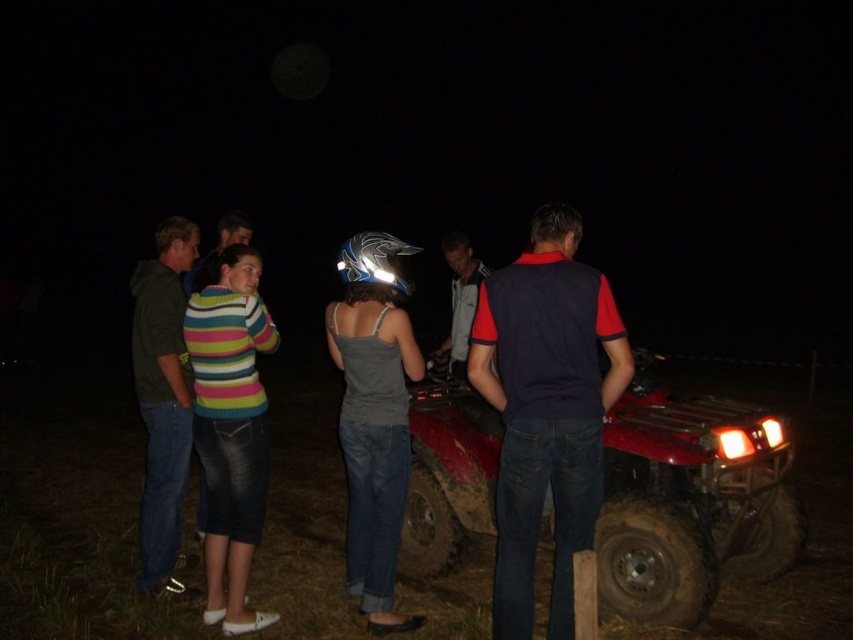
You are a photographer trying to capture a clear shot of the dark blue denim jeans at center and the matte red quad bike at center. Since the scene is dimly lit, you want to ensure both subjects are visible. Which object should you focus on first to avoid blurring, considering their positions?

The dark blue denim jeans at center is behind the matte red quad bike at center, so you should focus on the matte red quad bike at center first since it is closer to the camera and will be in focus before the background object.

You are organizing a clothing donation drive and need to determine which item takes up more space in the donation bin. Based on the scene, which clothing item is wider between the matte gray tank top at center and the striped sweater at center?

The matte gray tank top at center is wider than the striped sweater at center, so it takes up more space in the donation bin.

You are a photographer trying to capture a clear shot of the matte red quad bike at center and the dark blue denim jeans at center. Since the scene is dimly lit, you want to position your camera to focus on both subjects. Which object should you adjust your focus on first to ensure both are in frame?

The matte red quad bike at center is to the right of dark blue denim jeans at center, so you should focus on the dark blue denim jeans at center first to ensure both are in frame.